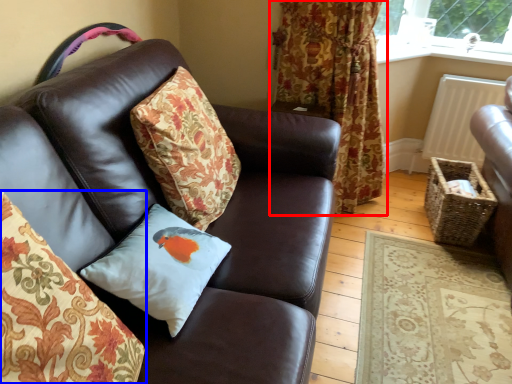
Question: Which object is further to the camera taking this photo, curtain (highlighted by a red box) or pillow (highlighted by a blue box)?

Choices:
 (A) curtain
 (B) pillow

Answer: (A)